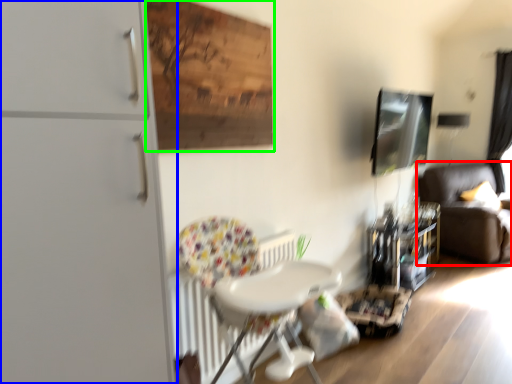
Question: Which is nearer to the studio couch (highlighted by a red box)? dresser (highlighted by a blue box) or plywood (highlighted by a green box).

Choices:
 (A) dresser
 (B) plywood

Answer: (B)